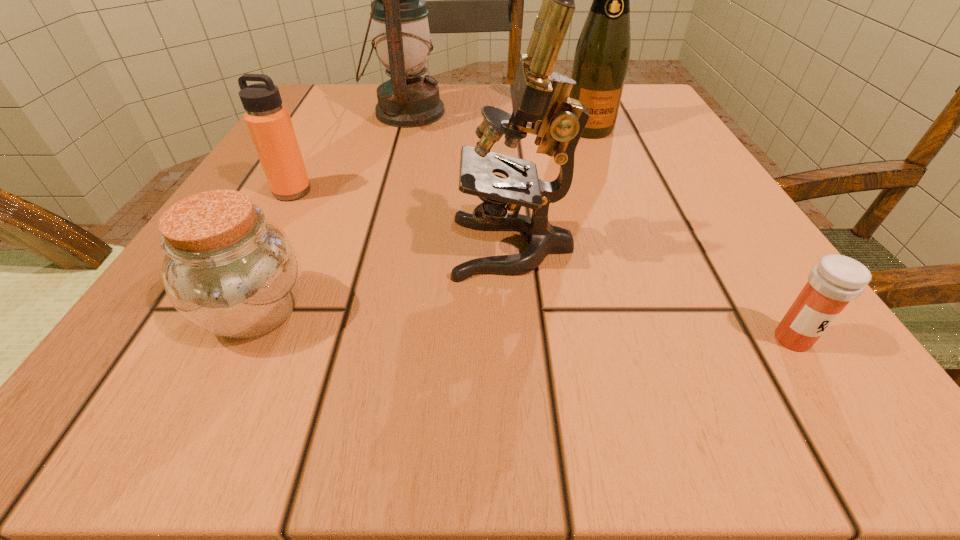
Find the location of a particular element. This screenshot has height=540, width=960. free space between the rightmost object and the thermos bottle is located at coordinates click(542, 265).

Find the location of a particular element. This screenshot has height=540, width=960. object that is the fourth closest one to the jar is located at coordinates (601, 58).

Select which object is the third closest to the second shortest object. Please provide its 2D coordinates. Your answer should be formatted as a tuple, i.e. [(x, y)], where the tuple contains the x and y coordinates of a point satisfying the conditions above.

[(402, 40)]

Find the location of a particular element. This screenshot has height=540, width=960. vacant space that satisfies the following two spatial constraints: 1. on the front-facing side of the wine bottle; 2. at the eyepieces of the third object from right to left is located at coordinates (636, 247).